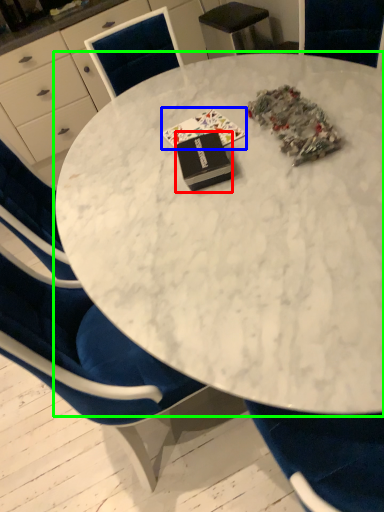
Question: Which object is positioned farthest from book (highlighted by a red box)? Select from book (highlighted by a blue box) and table (highlighted by a green box).

Choices:
 (A) book
 (B) table

Answer: (B)